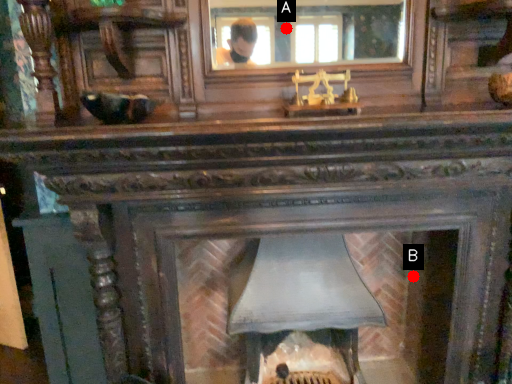
Question: Two points are circled on the image, labeled by A and B beside each circle. Which of the following is the farthest from the observer?

Choices:
 (A) A is further
 (B) B is further

Answer: (A)